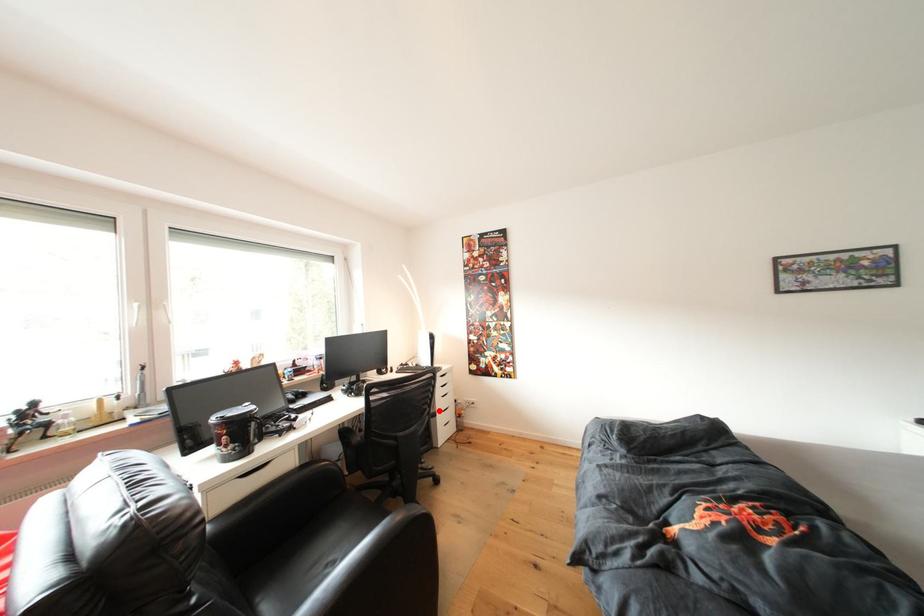
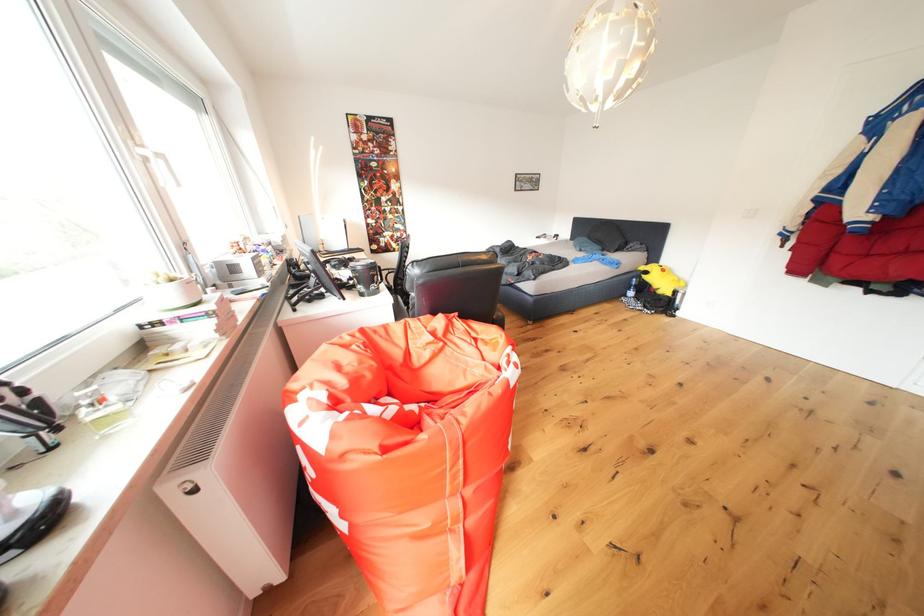
Question: I am providing you with two images of the same scene from different viewpoints. A red point is marked on the first image. Can you still see the location of the red point in image 2?

Choices:
 (A) Yes
 (B) No

Answer: (B)